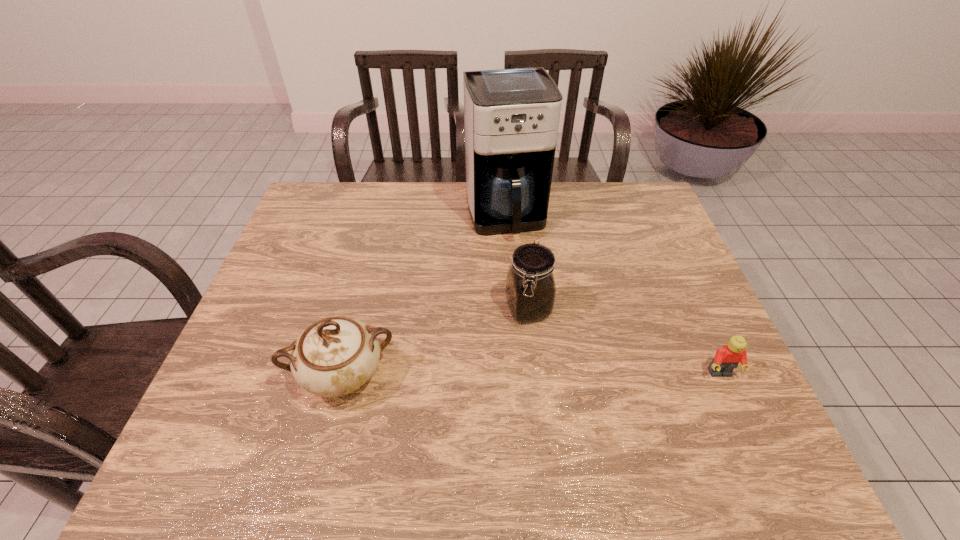
I want to click on vacant point located on the front panel of the coffee maker, so click(x=518, y=262).

This screenshot has width=960, height=540. What are the coordinates of `free region located 0.210m on the lid of the jar` in the screenshot? It's located at (566, 405).

I want to click on vacant region located 0.150m on the lid of the jar, so click(x=557, y=381).

Where is `vacant region located on the lid of the jar`? vacant region located on the lid of the jar is located at coordinates (541, 346).

Find the location of a particular element. Image resolution: width=960 pixels, height=540 pixels. object located in the far edge section of the desktop is located at coordinates (511, 116).

The height and width of the screenshot is (540, 960). What are the coordinates of `object that is positioned at the near edge` in the screenshot? It's located at (335, 356).

At what (x,y) coordinates should I click in order to perform the action: click on object that is positioned at the left edge. Please return your answer as a coordinate pair (x, y). The width and height of the screenshot is (960, 540). Looking at the image, I should click on (335, 356).

You are a GUI agent. You are given a task and a screenshot of the screen. Output one action in this format:
    pyautogui.click(x=<x>, y=<y>)
    Task: Click on the object that is positioned at the right edge
    
    Given the screenshot: What is the action you would take?
    pos(727,358)

Find the location of a particular element. Image resolution: width=960 pixels, height=540 pixels. object located in the near left corner section of the desktop is located at coordinates (335, 356).

Identify the location of free space at the far edge of the desktop. This screenshot has width=960, height=540. (358, 206).